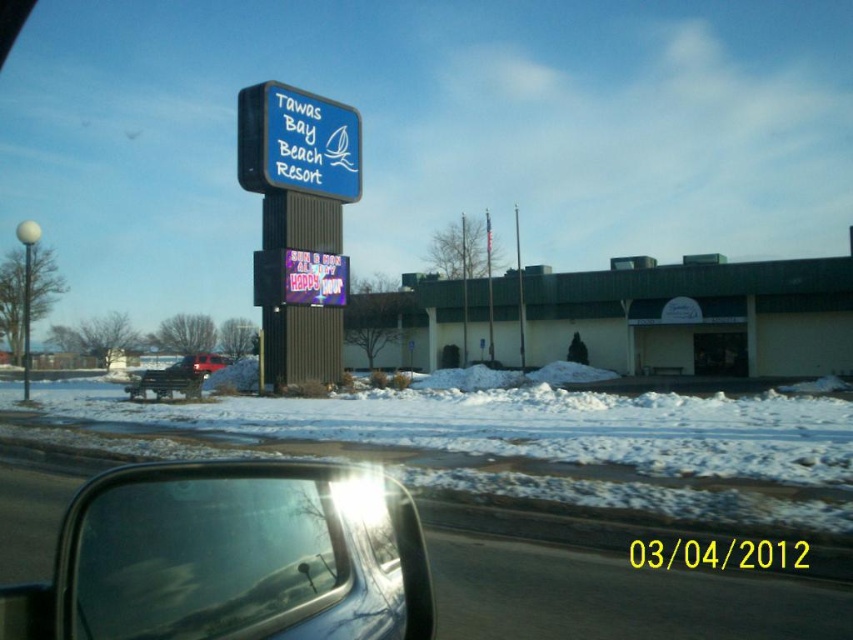
Who is more distant from viewer, (292, 257) or (196, 372)?

A: The point (292, 257) is more distant.

The height and width of the screenshot is (640, 853). I want to click on neon pink digital display at center, so click(x=314, y=278).

Looking at this image, which is above, white powdery snow at lower center or red matte truck at center?

white powdery snow at lower center is above.

The image size is (853, 640). Describe the element at coordinates (534, 426) in the screenshot. I see `white powdery snow at lower center` at that location.

You are a GUI agent. You are given a task and a screenshot of the screen. Output one action in this format:
    pyautogui.click(x=<x>, y=<y>)
    Task: Click on the white powdery snow at lower center
    The height and width of the screenshot is (640, 853).
    Given the screenshot: What is the action you would take?
    pyautogui.click(x=534, y=426)

Between transparent glass car window at lower left and blue plastic sign at upper center, which one appears on the right side from the viewer's perspective?

Positioned to the right is transparent glass car window at lower left.

Can you confirm if transparent glass car window at lower left is wider than blue plastic sign at upper center?

Yes.

The height and width of the screenshot is (640, 853). Identify the location of transparent glass car window at lower left. (206, 557).